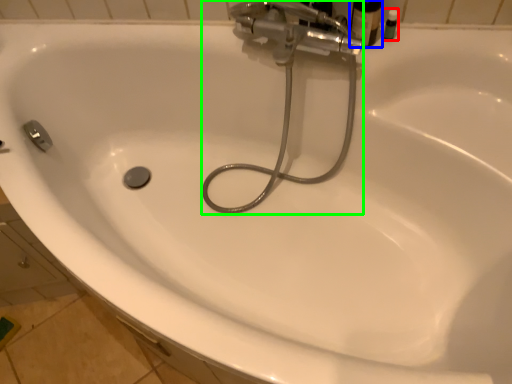
Question: Which object is the closest to the toiletry (highlighted by a red box)? Choose among these: toiletry (highlighted by a blue box) or plumbing fixture (highlighted by a green box).

Choices:
 (A) toiletry
 (B) plumbing fixture

Answer: (A)